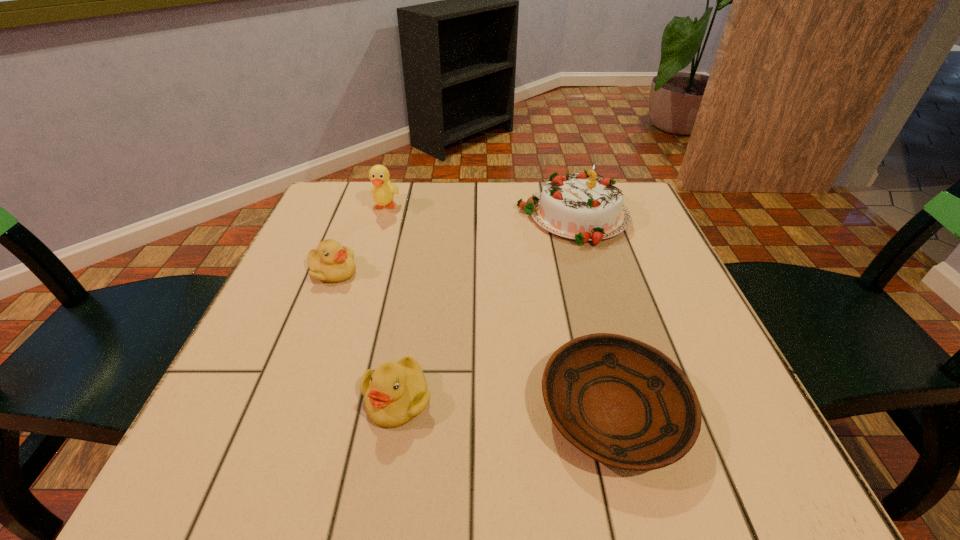
This screenshot has height=540, width=960. I want to click on free space that is in between the shortest object and the farthest duckling, so click(x=499, y=309).

This screenshot has height=540, width=960. I want to click on free spot between the cake and the third object from left to right, so click(485, 308).

Find the location of a particular element. This screenshot has height=540, width=960. unoccupied position between the farthest duckling and the rightmost duckling is located at coordinates (392, 303).

At what (x,y) coordinates should I click in order to perform the action: click on free space between the nearest duckling and the cake. Please return your answer as a coordinate pair (x, y). Looking at the image, I should click on (485, 308).

Locate an element on the screen. This screenshot has height=540, width=960. vacant area that lies between the cake and the third farthest object is located at coordinates (453, 245).

You are a GUI agent. You are given a task and a screenshot of the screen. Output one action in this format:
    pyautogui.click(x=<x>, y=<y>)
    Task: Click on the vacant region between the farthest duckling and the second nearest duckling
    This screenshot has width=960, height=540.
    Given the screenshot: What is the action you would take?
    pyautogui.click(x=359, y=239)

Where is `object that stands as the second closest to the second nearest duckling`? This screenshot has height=540, width=960. object that stands as the second closest to the second nearest duckling is located at coordinates (396, 392).

Find the location of `object that stands as the second closest to the shortest object`. object that stands as the second closest to the shortest object is located at coordinates (582, 206).

Identify the location of duckling that is the nearest to the farthest duckling. (331, 262).

You are a GUI agent. You are given a task and a screenshot of the screen. Output one action in this format:
    pyautogui.click(x=<x>, y=<y>)
    Task: Click on the duckling that stands as the second closest to the cake
    
    Given the screenshot: What is the action you would take?
    pyautogui.click(x=331, y=262)